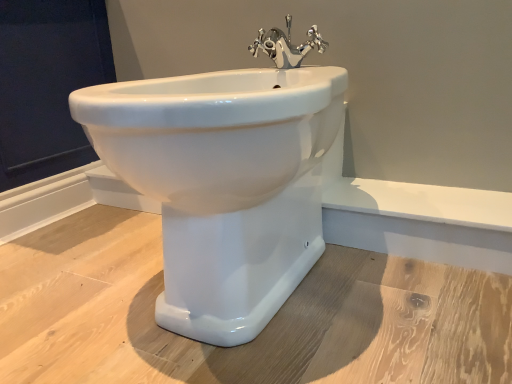
Question: Is chrome metallic faucet at upper center inside dark blue fabric at upper left?

Choices:
 (A) no
 (B) yes

Answer: (A)

Question: Can you confirm if dark blue fabric at upper left is shorter than chrome metallic faucet at upper center?

Choices:
 (A) yes
 (B) no

Answer: (B)

Question: Is dark blue fabric at upper left behind chrome metallic faucet at upper center?

Choices:
 (A) no
 (B) yes

Answer: (B)

Question: Is chrome metallic faucet at upper center at the back of dark blue fabric at upper left?

Choices:
 (A) yes
 (B) no

Answer: (B)

Question: Is dark blue fabric at upper left directly adjacent to chrome metallic faucet at upper center?

Choices:
 (A) yes
 (B) no

Answer: (B)

Question: Considering their positions, is dark blue fabric at upper left located in front of or behind white glossy bidet at center?

Choices:
 (A) behind
 (B) front

Answer: (A)

Question: Do you think dark blue fabric at upper left is within white glossy bidet at center, or outside of it?

Choices:
 (A) outside
 (B) inside

Answer: (A)

Question: From their relative heights in the image, would you say dark blue fabric at upper left is taller or shorter than white glossy bidet at center?

Choices:
 (A) short
 (B) tall

Answer: (B)

Question: Looking at their shapes, would you say dark blue fabric at upper left is wider or thinner than white glossy bidet at center?

Choices:
 (A) wide
 (B) thin

Answer: (B)

Question: From the image's perspective, is chrome metallic faucet at upper center above or below white glossy bidet at center?

Choices:
 (A) above
 (B) below

Answer: (A)

Question: Which is correct: chrome metallic faucet at upper center is inside white glossy bidet at center, or outside of it?

Choices:
 (A) inside
 (B) outside

Answer: (A)

Question: Considering their positions, is chrome metallic faucet at upper center located in front of or behind white glossy bidet at center?

Choices:
 (A) behind
 (B) front

Answer: (A)

Question: In terms of width, does chrome metallic faucet at upper center look wider or thinner when compared to white glossy bidet at center?

Choices:
 (A) wide
 (B) thin

Answer: (B)

Question: Does point (293, 64) appear closer or farther from the camera than point (93, 4)?

Choices:
 (A) farther
 (B) closer

Answer: (B)

Question: Looking at their shapes, would you say chrome metallic faucet at upper center is wider or thinner than dark blue fabric at upper left?

Choices:
 (A) thin
 (B) wide

Answer: (A)